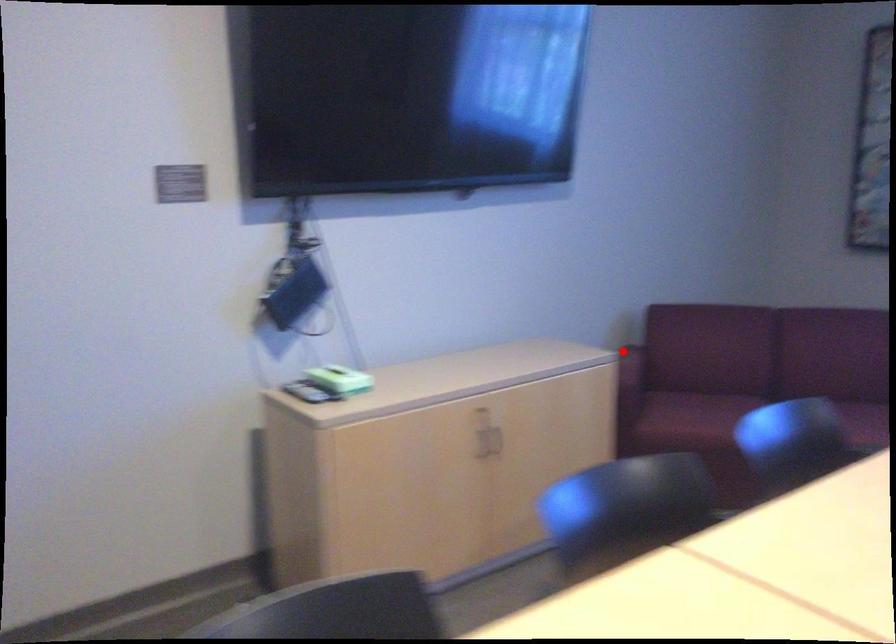
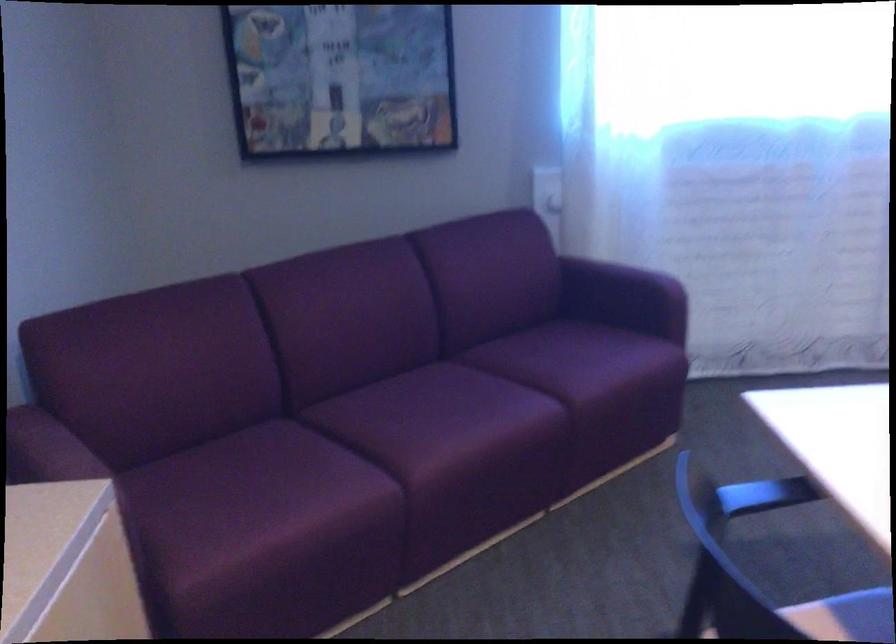
Where in the second image is the point corresponding to the highlighted location from the first image?

(33, 446)